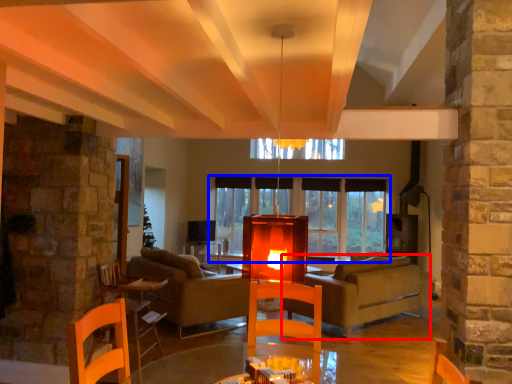
Question: Which object appears closest to the camera in this image, studio couch (highlighted by a red box) or window (highlighted by a blue box)?

Choices:
 (A) studio couch
 (B) window

Answer: (A)